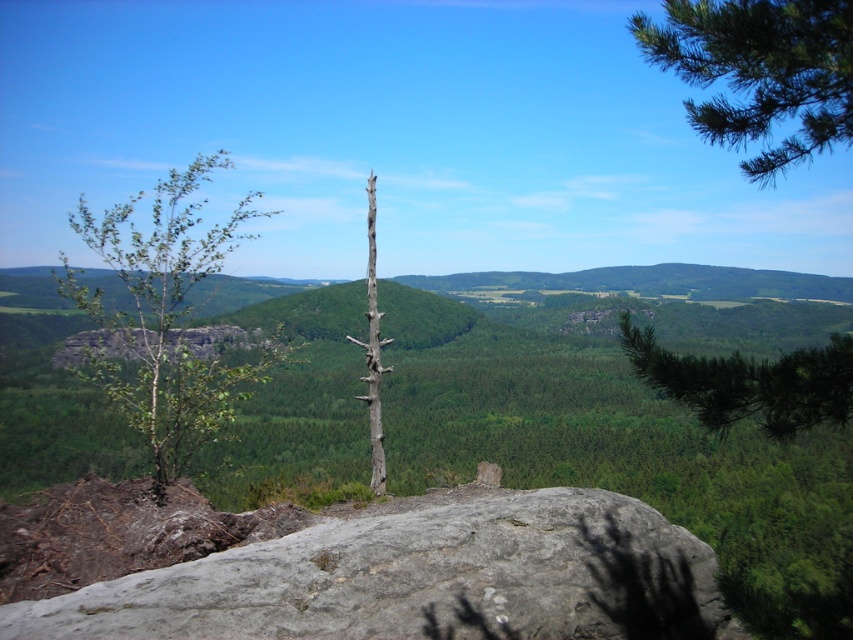
Between point (212, 621) and point (650, 374), which one is positioned behind?

Positioned behind is point (212, 621).

Does point (601, 577) come closer to viewer compared to point (782, 387)?

No, (601, 577) is further to viewer.

Which is in front, point (358, 612) or point (791, 376)?

Positioned in front is point (791, 376).

This screenshot has height=640, width=853. I want to click on gray rough rock at center, so click(421, 577).

Is green leafy tree at left positioned at the back of green needle-like at right?

Yes, green leafy tree at left is behind green needle-like at right.

Can you confirm if green leafy tree at left is positioned to the left of green needle-like at right?

Correct, you'll find green leafy tree at left to the left of green needle-like at right.

Who is more forward, (167, 358) or (724, 362)?

Point (724, 362) is more forward.

Where is `green leafy tree at left`? The width and height of the screenshot is (853, 640). green leafy tree at left is located at coordinates (163, 316).

The width and height of the screenshot is (853, 640). Describe the element at coordinates (421, 577) in the screenshot. I see `gray rough rock at center` at that location.

Which is in front, point (322, 596) or point (186, 346)?

Point (322, 596) is in front.

Where is `gray rough rock at center`? This screenshot has width=853, height=640. gray rough rock at center is located at coordinates (421, 577).